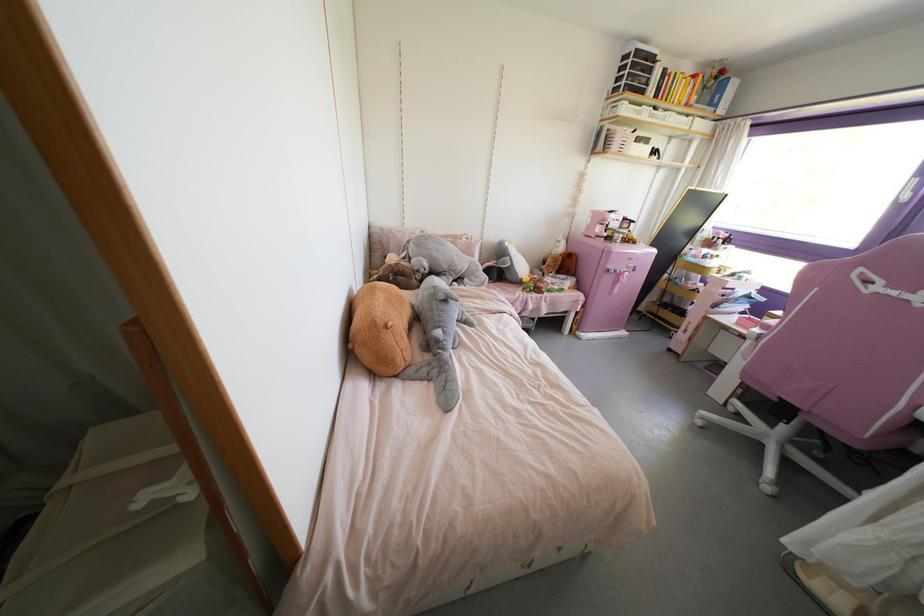
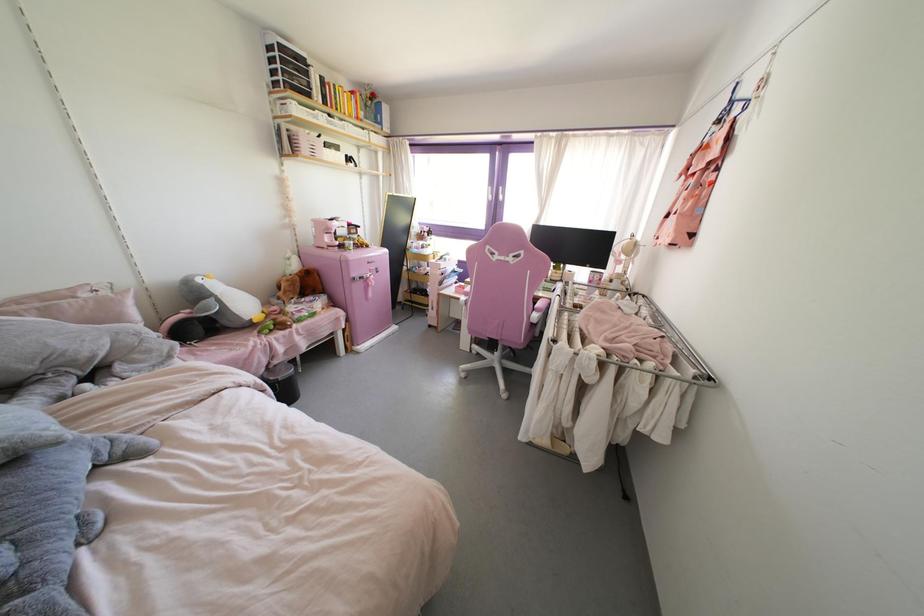
Locate, in the second image, the point that corresponds to point 633,270 in the first image.

(377, 272)